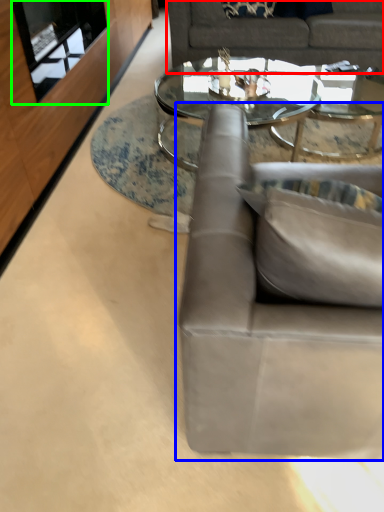
Question: Based on their relative distances, which object is nearer to studio couch (highlighted by a red box)? Choose from studio couch (highlighted by a blue box) and glass door (highlighted by a green box).

Choices:
 (A) studio couch
 (B) glass door

Answer: (B)